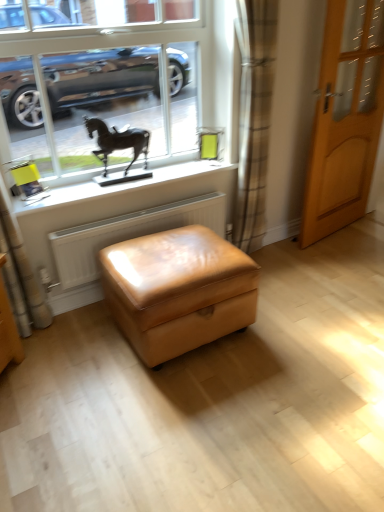
Question: From a real-world perspective, is light brown wooden door at right under plaid fabric curtain at center?

Choices:
 (A) yes
 (B) no

Answer: (A)

Question: From the image's perspective, is light brown wooden door at right under plaid fabric curtain at center?

Choices:
 (A) yes
 (B) no

Answer: (B)

Question: From a real-world perspective, is light brown wooden door at right located higher than plaid fabric curtain at center?

Choices:
 (A) yes
 (B) no

Answer: (B)

Question: Does light brown wooden door at right have a smaller size compared to plaid fabric curtain at center?

Choices:
 (A) no
 (B) yes

Answer: (A)

Question: Is light brown wooden door at right thinner than plaid fabric curtain at center?

Choices:
 (A) no
 (B) yes

Answer: (B)

Question: Does point (170, 190) appear closer or farther from the camera than point (91, 129)?

Choices:
 (A) closer
 (B) farther

Answer: (B)

Question: Is white matte window sill at upper center taller or shorter than black metal horse at upper center?

Choices:
 (A) tall
 (B) short

Answer: (B)

Question: Is white matte window sill at upper center to the left or to the right of black metal horse at upper center in the image?

Choices:
 (A) left
 (B) right

Answer: (B)

Question: Which is correct: white matte window sill at upper center is inside black metal horse at upper center, or outside of it?

Choices:
 (A) inside
 (B) outside

Answer: (B)

Question: From their relative heights in the image, would you say metallic horse statue at upper left is taller or shorter than black metal horse at upper center?

Choices:
 (A) tall
 (B) short

Answer: (A)

Question: Is metallic horse statue at upper left in front of or behind black metal horse at upper center in the image?

Choices:
 (A) behind
 (B) front

Answer: (B)

Question: From the image's perspective, is metallic horse statue at upper left positioned above or below black metal horse at upper center?

Choices:
 (A) above
 (B) below

Answer: (A)

Question: Is metallic horse statue at upper left bigger or smaller than black metal horse at upper center?

Choices:
 (A) small
 (B) big

Answer: (B)

Question: Based on their positions, is leather ottoman at center located to the left or right of plaid fabric curtain at center?

Choices:
 (A) right
 (B) left

Answer: (B)

Question: Considering the positions of leather ottoman at center and plaid fabric curtain at center in the image, is leather ottoman at center wider or thinner than plaid fabric curtain at center?

Choices:
 (A) thin
 (B) wide

Answer: (B)